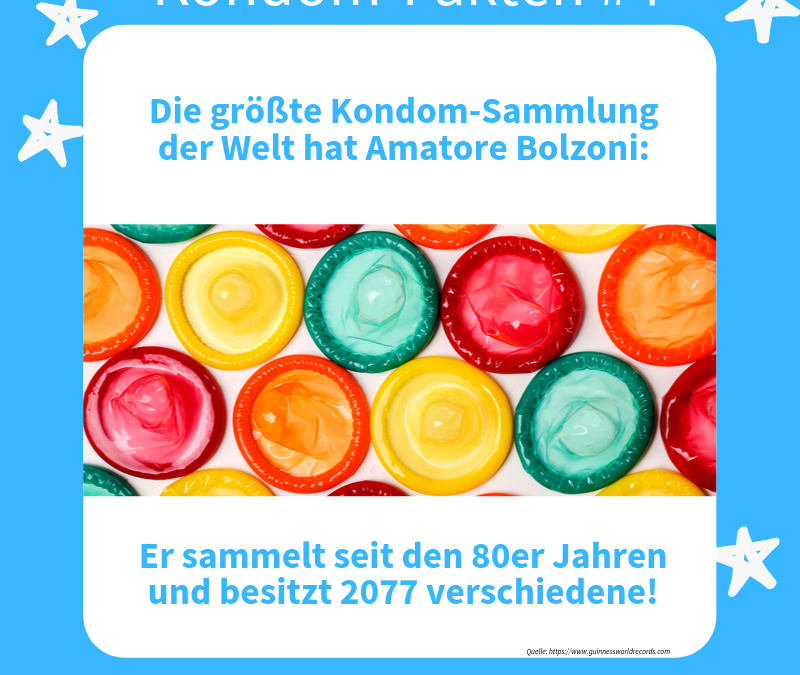
At what (x,y) coordinates should I click in order to perform the action: click on space above picture. Please return your answer as a coordinate pair (x, y). Looking at the image, I should click on (404, 194).